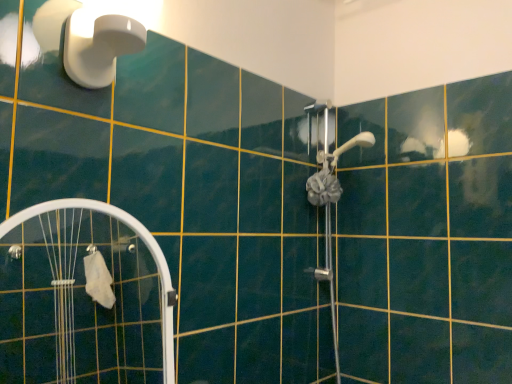
This screenshot has width=512, height=384. Describe the element at coordinates (83, 298) in the screenshot. I see `white translucent screen door at lower left` at that location.

Locate an element on the screen. The width and height of the screenshot is (512, 384). white translucent screen door at lower left is located at coordinates (83, 298).

What is the approximate height of white translucent screen door at lower left?

white translucent screen door at lower left is 17.72 inches in height.

Describe the element at coordinates (99, 45) in the screenshot. I see `white plastic shower at upper left` at that location.

Identify the location of white plastic shower at upper left. (99, 45).

At what (x,y) coordinates should I click in order to perform the action: click on white translucent screen door at lower left. Please return your answer as a coordinate pair (x, y). The image size is (512, 384). Looking at the image, I should click on (83, 298).

Between white translucent screen door at lower left and white plastic shower at upper left, which one appears on the left side from the viewer's perspective?

white translucent screen door at lower left is more to the left.

Is white translucent screen door at lower left in front of or behind white plastic shower at upper left in the image?

Visually, white translucent screen door at lower left is located in front of white plastic shower at upper left.

Is point (94, 312) positioned in front of point (71, 54)?

No.

From the image's perspective, is white translucent screen door at lower left above or below white plastic shower at upper left?

From the image's perspective, white translucent screen door at lower left appears below white plastic shower at upper left.

From a real-world perspective, which is physically above, white translucent screen door at lower left or white plastic shower at upper left?

white plastic shower at upper left is physically above.

Between white translucent screen door at lower left and white plastic shower at upper left, which one has larger width?

With larger width is white plastic shower at upper left.

Consider the image. Between white translucent screen door at lower left and white plastic shower at upper left, which one has less height?

white plastic shower at upper left.

Based on the photo, is white translucent screen door at lower left bigger or smaller than white plastic shower at upper left?

Considering their sizes, white translucent screen door at lower left takes up more space than white plastic shower at upper left.

Would you say white translucent screen door at lower left is outside white plastic shower at upper left?

white translucent screen door at lower left lies outside white plastic shower at upper left's area.

Is there a large distance between white translucent screen door at lower left and white plastic shower at upper left?

Yes, white translucent screen door at lower left and white plastic shower at upper left are located far from each other.

Could you tell me if white translucent screen door at lower left is turned towards white plastic shower at upper left?

No, white translucent screen door at lower left is not oriented towards white plastic shower at upper left.

How many degrees apart are the facing directions of white translucent screen door at lower left and white plastic shower at upper left?

0.146 degrees.

Locate an element on the screen. This screenshot has width=512, height=384. screen door located below the white plastic shower at upper left (from the image's perspective) is located at coordinates (83, 298).

Is white plastic shower at upper left to the left or to the right of white translucent screen door at lower left in the image?

Based on their positions, white plastic shower at upper left is located to the right of white translucent screen door at lower left.

Is white plastic shower at upper left closer to the viewer compared to white translucent screen door at lower left?

No, white plastic shower at upper left is further to the viewer.

Which is nearer, (x=109, y=50) or (x=5, y=288)?

Clearly, point (x=109, y=50) is closer to the camera than point (x=5, y=288).

From the image's perspective, is white plastic shower at upper left on white translucent screen door at lower left?

Yes, from the image's perspective, white plastic shower at upper left is above white translucent screen door at lower left.

From a real-world perspective, relative to white translucent screen door at lower left, is white plastic shower at upper left vertically above or below?

Clearly, from a real-world perspective, white plastic shower at upper left is above white translucent screen door at lower left.

Is white plastic shower at upper left wider or thinner than white translucent screen door at lower left?

In the image, white plastic shower at upper left appears to be wider than white translucent screen door at lower left.

Considering the relative sizes of white plastic shower at upper left and white translucent screen door at lower left in the image provided, is white plastic shower at upper left taller than white translucent screen door at lower left?

In fact, white plastic shower at upper left may be shorter than white translucent screen door at lower left.

Based on their sizes in the image, would you say white plastic shower at upper left is bigger or smaller than white translucent screen door at lower left?

In the image, white plastic shower at upper left appears to be smaller than white translucent screen door at lower left.

Choose the correct answer: Is white plastic shower at upper left inside white translucent screen door at lower left or outside it?

white plastic shower at upper left exists outside the volume of white translucent screen door at lower left.

Is white plastic shower at upper left placed right next to white translucent screen door at lower left?

No.

Looking at this image, does white plastic shower at upper left turn towards white translucent screen door at lower left?

No.

What's the angular difference between white plastic shower at upper left and white translucent screen door at lower left's facing directions?

There is a 0.146-degree angle between the facing directions of white plastic shower at upper left and white translucent screen door at lower left.

At what (x,y) coordinates should I click in order to perform the action: click on shower that is on the right side of white translucent screen door at lower left. Please return your answer as a coordinate pair (x, y). Image resolution: width=512 pixels, height=384 pixels. Looking at the image, I should click on (99, 45).

Find the location of a particular element. This screenshot has height=384, width=512. shower that is above the white translucent screen door at lower left (from the image's perspective) is located at coordinates (99, 45).

What are the coordinates of `shower that is on the right side of white translucent screen door at lower left` in the screenshot? It's located at (99, 45).